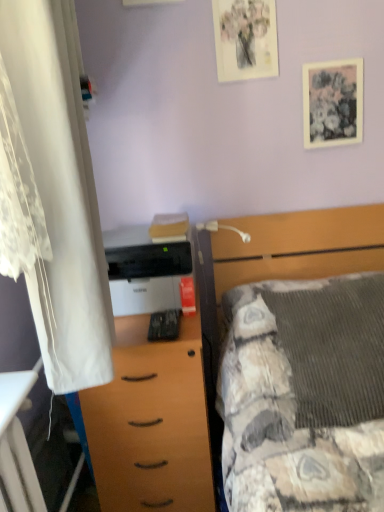
Question: Does textured gray blanket at center come in front of wooden desk at lower left?

Choices:
 (A) yes
 (B) no

Answer: (B)

Question: Can you confirm if textured gray blanket at center is bigger than wooden desk at lower left?

Choices:
 (A) yes
 (B) no

Answer: (A)

Question: Could you tell me if textured gray blanket at center is facing wooden desk at lower left?

Choices:
 (A) no
 (B) yes

Answer: (A)

Question: Is textured gray blanket at center at the left side of wooden desk at lower left?

Choices:
 (A) no
 (B) yes

Answer: (A)

Question: From a real-world perspective, does textured gray blanket at center stand above wooden desk at lower left?

Choices:
 (A) no
 (B) yes

Answer: (B)

Question: Does textured gray blanket at center have a lesser width compared to wooden desk at lower left?

Choices:
 (A) no
 (B) yes

Answer: (A)

Question: Is wooden chest of drawers at center facing away from white lace curtain at left?

Choices:
 (A) no
 (B) yes

Answer: (A)

Question: From a real-world perspective, is wooden chest of drawers at center positioned over white lace curtain at left based on gravity?

Choices:
 (A) no
 (B) yes

Answer: (A)

Question: From a real-world perspective, is wooden chest of drawers at center beneath white lace curtain at left?

Choices:
 (A) yes
 (B) no

Answer: (A)

Question: Could you tell me if wooden chest of drawers at center is facing white lace curtain at left?

Choices:
 (A) yes
 (B) no

Answer: (B)

Question: Can you confirm if wooden chest of drawers at center is thinner than white lace curtain at left?

Choices:
 (A) no
 (B) yes

Answer: (A)

Question: From the image's perspective, is wooden chest of drawers at center below white lace curtain at left?

Choices:
 (A) no
 (B) yes

Answer: (B)

Question: Does white plastic lamp at upper center have a lesser width compared to white matte printer at center?

Choices:
 (A) no
 (B) yes

Answer: (A)